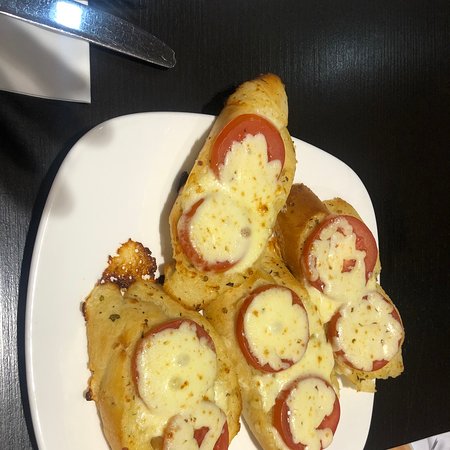
In order to click on plate in this screenshot , I will do `click(63, 246)`, `click(355, 411)`.